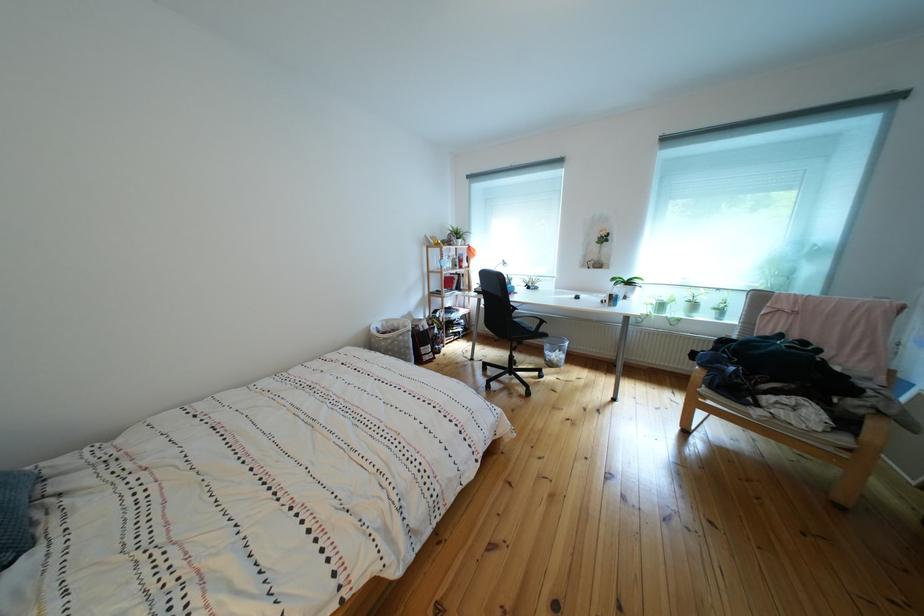
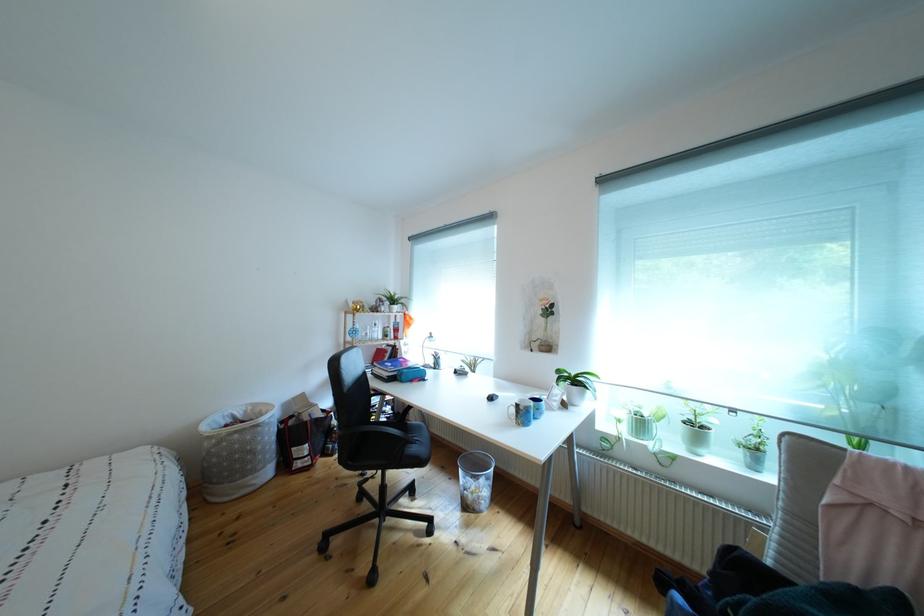
In the second image, find the point that corresponds to pixel 447 336 in the first image.

(346, 428)